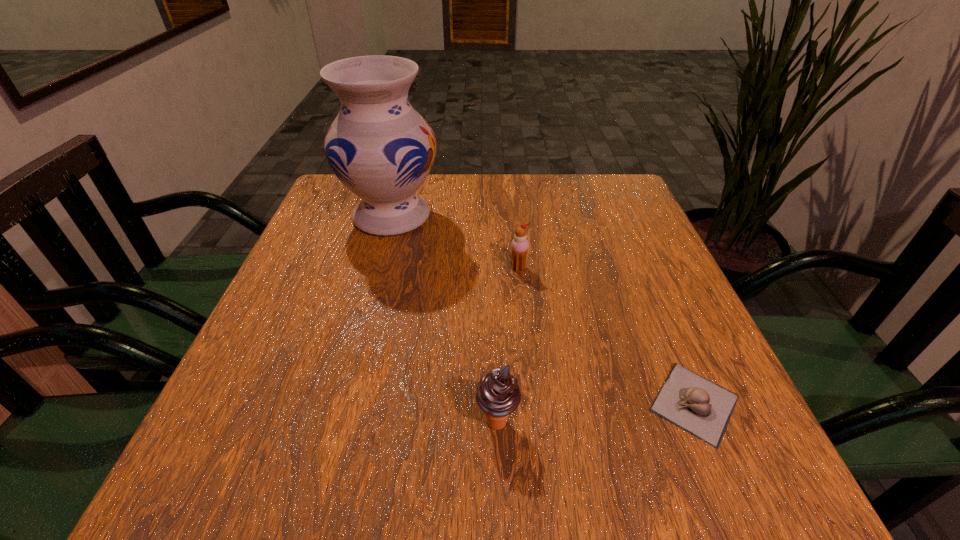
This screenshot has height=540, width=960. Find the location of `free region located 0.370m at the front with a straw on the second farthest object`. free region located 0.370m at the front with a straw on the second farthest object is located at coordinates (535, 431).

Identify the location of vacant position located on the left of the rightmost object. Image resolution: width=960 pixels, height=540 pixels. (496, 403).

The image size is (960, 540). Identify the location of object that is positioned at the far edge. (380, 148).

I want to click on object that is at the near edge, so click(x=695, y=404).

You are a GUI agent. You are given a task and a screenshot of the screen. Output one action in this format:
    pyautogui.click(x=<x>, y=<y>)
    Task: Click on the object located in the left edge section of the desktop
    
    Given the screenshot: What is the action you would take?
    pyautogui.click(x=380, y=148)

The width and height of the screenshot is (960, 540). What are the coordinates of `object located at the right edge` in the screenshot? It's located at (695, 404).

In order to click on object that is at the far left corner in this screenshot , I will do `click(380, 148)`.

Identify the location of object that is at the near right corner. Image resolution: width=960 pixels, height=540 pixels. (695, 404).

Find the location of a particular element. The height and width of the screenshot is (540, 960). free space at the far edge of the desktop is located at coordinates (432, 195).

Where is `vacant region at the near edge of the desktop`? The width and height of the screenshot is (960, 540). vacant region at the near edge of the desktop is located at coordinates (547, 499).